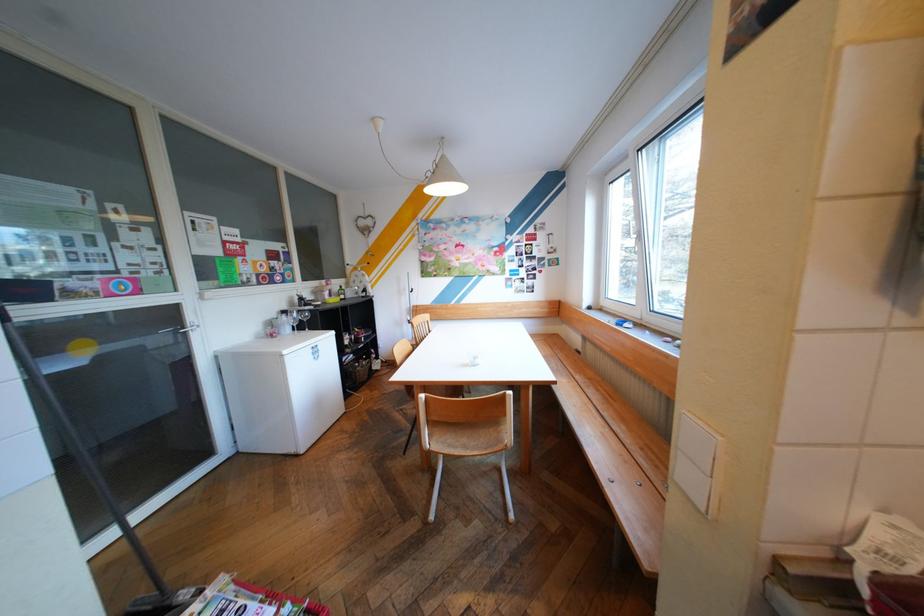
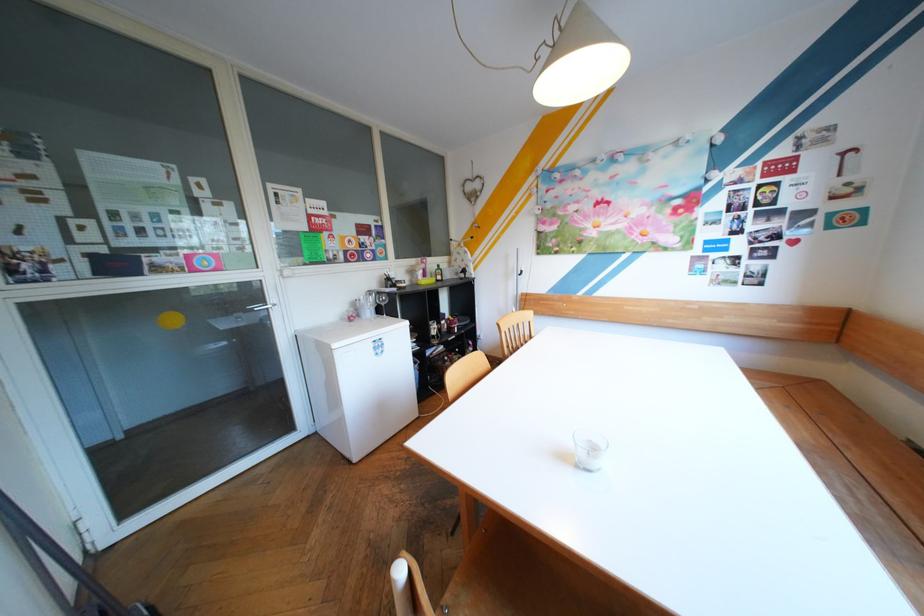
Question: The images are taken continuously from a first-person perspective. In which direction is your viewpoint rotating?

Choices:
 (A) Left
 (B) Right
 (C) Up
 (D) Down

Answer: (A)